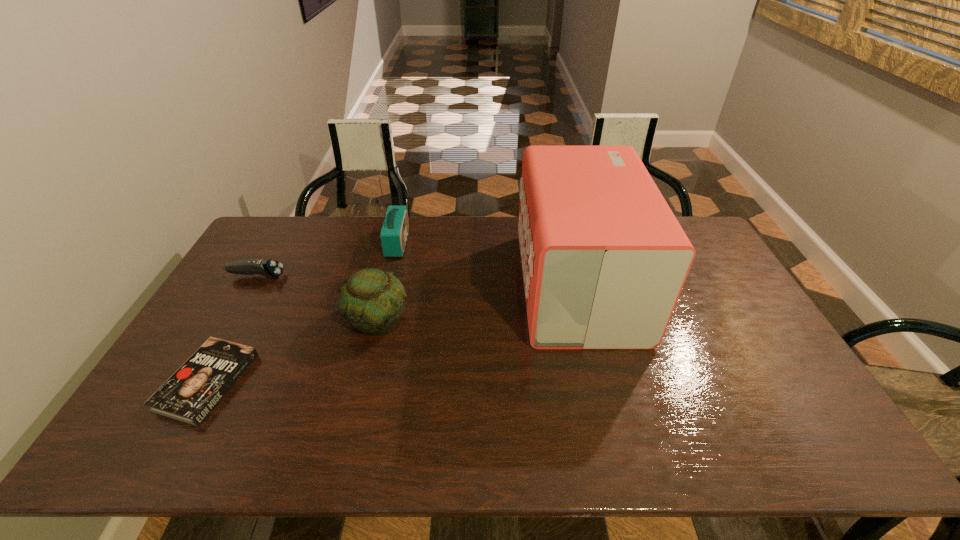
Locate an element on the screen. The image size is (960, 540). the rightmost object is located at coordinates (604, 260).

The image size is (960, 540). I want to click on box, so click(604, 260).

Locate an element on the screen. radio receiver is located at coordinates (394, 232).

Find the location of a particular element. The image size is (960, 540). pottery is located at coordinates (372, 300).

Identify the location of the fourth tallest object. (269, 268).

This screenshot has width=960, height=540. Find the location of `book`. book is located at coordinates (191, 393).

Locate an element on the screen. This screenshot has width=960, height=540. free region located 0.400m on the surface of the tallest object where the text is embossed is located at coordinates (396, 286).

You are a GUI agent. You are given a task and a screenshot of the screen. Output one action in this format:
    pyautogui.click(x=<x>, y=<y>)
    Task: Click on the free space located on the surface of the tallest object where the text is embossed
    
    Given the screenshot: What is the action you would take?
    pyautogui.click(x=476, y=286)

The width and height of the screenshot is (960, 540). In order to click on blank space located 0.200m on the surface of the tallest object where the text is embossed in this screenshot , I will do `click(458, 286)`.

Locate an element on the screen. Image resolution: width=960 pixels, height=540 pixels. vacant space situated on the front panel of the second tallest object is located at coordinates click(x=489, y=243).